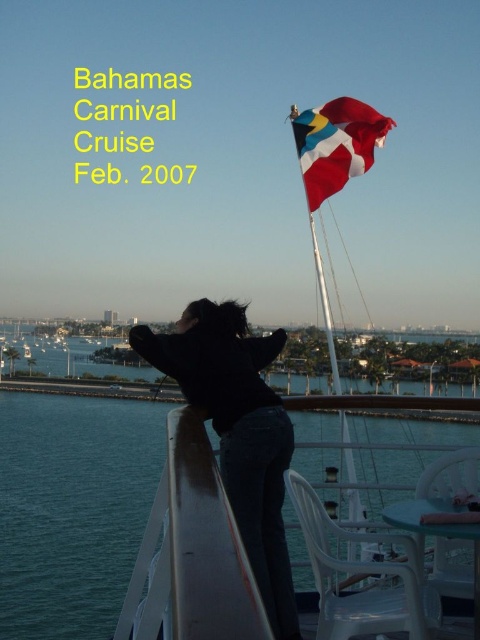
You are a photographer on the cruise ship deck. You notice the white plastic boat at upper center and the red fabric flag at upper center. Which object is wider?

The white plastic boat at upper center is wider than the red fabric flag at upper center.

Based on the scene description, where is the white plastic boat at upper center located in relation to the deck railings and the person?

The white plastic boat at upper center is located at point coordinates of (189, 369), which is above the deck railings and in front of the person standing on the deck.

You are standing on the deck of the cruise ship and want to take a photo of the white plastic boat at upper center without the blue water at lower left blocking the view. Is this possible?

The white plastic boat at upper center is behind the blue water at lower left, so it would be blocked by the blue water at lower left. Therefore, you cannot take a photo of the white plastic boat at upper center without the blue water at lower left blocking the view.